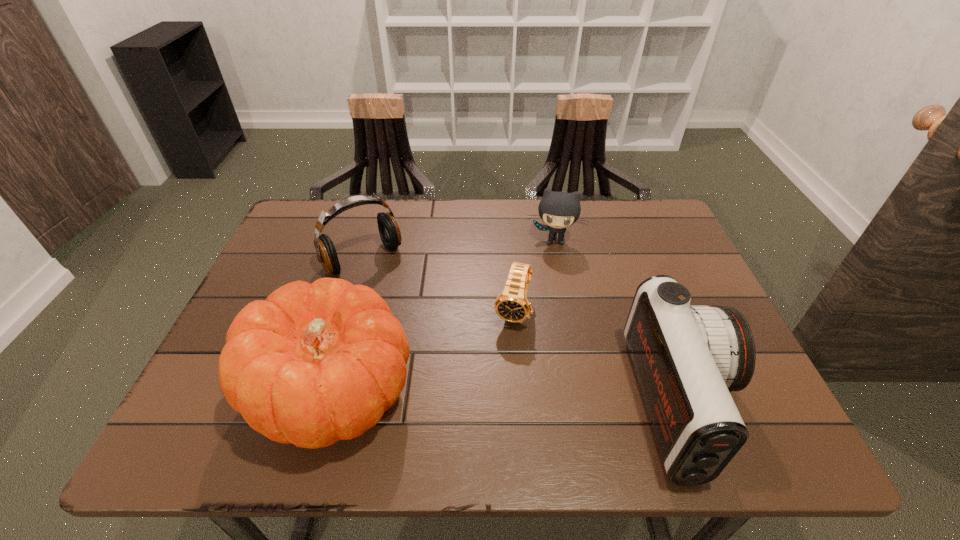
Find the location of a particular element. This screenshot has height=540, width=960. pumpkin is located at coordinates (313, 364).

Identify the location of the rightmost object. (688, 358).

This screenshot has width=960, height=540. In order to click on kitten in this screenshot , I will do `click(558, 210)`.

Where is `the fourth object from left to right`? This screenshot has height=540, width=960. the fourth object from left to right is located at coordinates point(558,210).

At what (x,y) coordinates should I click in order to perform the action: click on the shortest object. Please return your answer as a coordinate pair (x, y). The image size is (960, 540). Looking at the image, I should click on (512, 305).

At what (x,y) coordinates should I click in order to perform the action: click on watch. Please return your answer as a coordinate pair (x, y). Looking at the image, I should click on 512,305.

Locate an element on the screen. headset is located at coordinates (389, 231).

Locate an element on the screen. The width and height of the screenshot is (960, 540). vacant space located on the left of the pumpkin is located at coordinates (226, 392).

Where is `free space located 0.070m on the surface of the camcorder`? The width and height of the screenshot is (960, 540). free space located 0.070m on the surface of the camcorder is located at coordinates (759, 404).

In order to click on vacant space located 0.150m on the front-facing side of the kitten in this screenshot , I will do `click(547, 287)`.